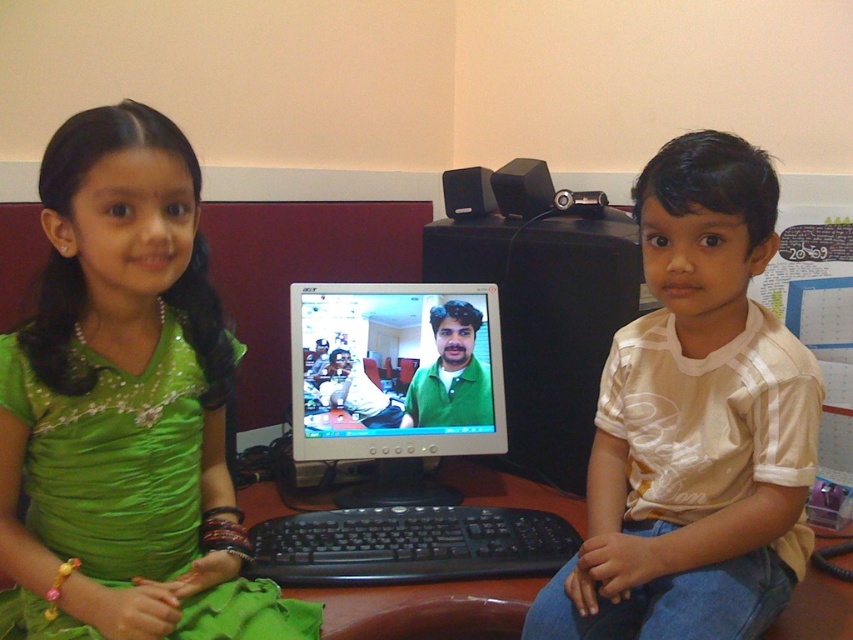
Question: Can you confirm if green satin dress at left is positioned to the right of white striped t-shirt at center?

Choices:
 (A) yes
 (B) no

Answer: (B)

Question: Is white striped t-shirt at center smaller than black plastic keyboard at center?

Choices:
 (A) yes
 (B) no

Answer: (B)

Question: Which is farther from the matte black monitor at center?

Choices:
 (A) brown wooden desk at center
 (B) black plastic keyboard at center

Answer: (A)

Question: Which point is farther to the camera?

Choices:
 (A) (489, 513)
 (B) (96, 378)
 (C) (647, 522)
 (D) (412, 387)

Answer: (D)

Question: Does matte black monitor at center appear over black plastic keyboard at center?

Choices:
 (A) yes
 (B) no

Answer: (A)

Question: Which of the following is the farthest from the observer?

Choices:
 (A) (677, 557)
 (B) (376, 573)
 (C) (257, 502)
 (D) (316, 316)

Answer: (C)